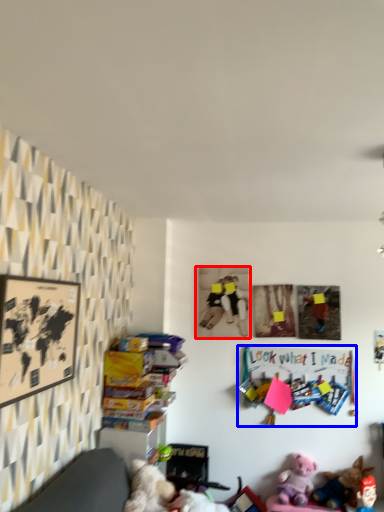
Question: Which of the following is the closest to the observer, picture frame (highlighted by a red box) or bulletin board (highlighted by a blue box)?

Choices:
 (A) picture frame
 (B) bulletin board

Answer: (B)